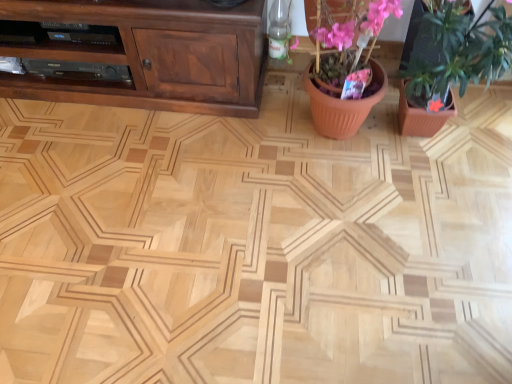
The width and height of the screenshot is (512, 384). What do you see at coordinates (151, 55) in the screenshot?
I see `brown wood cabinet at upper left` at bounding box center [151, 55].

The width and height of the screenshot is (512, 384). What do you see at coordinates (347, 69) in the screenshot? I see `terracotta pot at center` at bounding box center [347, 69].

This screenshot has width=512, height=384. What do you see at coordinates (451, 63) in the screenshot?
I see `pink matte flower pot at upper right` at bounding box center [451, 63].

Identify the location of pink matte flower pot at upper right. (451, 63).

Where is `brown wood cabinet at upper left`? brown wood cabinet at upper left is located at coordinates (151, 55).

From the picture: Is the depth of brown wood cabinet at upper left greater than that of pink matte flower pot at upper right?

Yes, brown wood cabinet at upper left is further from the camera.

Between brown wood cabinet at upper left and pink matte flower pot at upper right, which one appears on the left side from the viewer's perspective?

From the viewer's perspective, brown wood cabinet at upper left appears more on the left side.

Where is `houseplant that is above the brown wood cabinet at upper left (from a real-world perspective)`? The image size is (512, 384). houseplant that is above the brown wood cabinet at upper left (from a real-world perspective) is located at coordinates (451, 63).

From the picture: Are brown wood cabinet at upper left and pink matte flower pot at upper right located far from each other?

No, there isn't a large distance between brown wood cabinet at upper left and pink matte flower pot at upper right.

Image resolution: width=512 pixels, height=384 pixels. I want to click on houseplant that is above the terracotta pot at center (from a real-world perspective), so click(451, 63).

Can you confirm if terracotta pot at center is thinner than pink matte flower pot at upper right?

Correct, the width of terracotta pot at center is less than that of pink matte flower pot at upper right.

Based on the photo, which is more distant, [355,94] or [441,31]?

The point [355,94] is behind.

Is terracotta pot at center behind brown wood cabinet at upper left?

No, it is in front of brown wood cabinet at upper left.

Is brown wood cabinet at upper left surrounded by terracotta pot at center?

Definitely not — brown wood cabinet at upper left is not inside terracotta pot at center.

Considering the positions of objects terracotta pot at center and brown wood cabinet at upper left in the image provided, who is more to the left, terracotta pot at center or brown wood cabinet at upper left?

brown wood cabinet at upper left.

How far apart are terracotta pot at center and brown wood cabinet at upper left?

terracotta pot at center is 47.11 centimeters from brown wood cabinet at upper left.

Does pink matte flower pot at upper right lie behind brown wood cabinet at upper left?

No, the depth of pink matte flower pot at upper right is less than that of brown wood cabinet at upper left.

Can you tell me how much pink matte flower pot at upper right and brown wood cabinet at upper left differ in facing direction?

The facing directions of pink matte flower pot at upper right and brown wood cabinet at upper left are 6.99e-05 degrees apart.

From the image's perspective, which object appears higher, pink matte flower pot at upper right or brown wood cabinet at upper left?

brown wood cabinet at upper left is shown above in the image.

From the image's perspective, is brown wood cabinet at upper left above terracotta pot at center?

Yes, from the image's perspective, brown wood cabinet at upper left is over terracotta pot at center.

Which object is thinner, brown wood cabinet at upper left or terracotta pot at center?

Thinner between the two is terracotta pot at center.

Based on the photo, can you tell me how much brown wood cabinet at upper left and terracotta pot at center differ in facing direction?

The facing directions of brown wood cabinet at upper left and terracotta pot at center are 1.23e-05 degrees apart.

Is pink matte flower pot at upper right taller than terracotta pot at center?

Indeed, pink matte flower pot at upper right has a greater height compared to terracotta pot at center.

Is pink matte flower pot at upper right oriented towards terracotta pot at center?

No, pink matte flower pot at upper right does not turn towards terracotta pot at center.

Considering the sizes of objects pink matte flower pot at upper right and terracotta pot at center in the image provided, who is smaller, pink matte flower pot at upper right or terracotta pot at center?

With smaller size is terracotta pot at center.

I want to click on cabinetry above the pink matte flower pot at upper right (from the image's perspective), so click(x=151, y=55).

Locate an element on the screen. floral arrangement below the pink matte flower pot at upper right (from a real-world perspective) is located at coordinates (347, 69).

Considering their positions, is brown wood cabinet at upper left positioned further to pink matte flower pot at upper right than terracotta pot at center?

brown wood cabinet at upper left is further to pink matte flower pot at upper right.

Based on their spatial positions, is terracotta pot at center or brown wood cabinet at upper left further from pink matte flower pot at upper right?

brown wood cabinet at upper left lies further to pink matte flower pot at upper right than the other object.

Based on their spatial positions, is terracotta pot at center or pink matte flower pot at upper right closer to brown wood cabinet at upper left?

terracotta pot at center is closer to brown wood cabinet at upper left.

From the image, which object appears to be nearer to brown wood cabinet at upper left, pink matte flower pot at upper right or terracotta pot at center?

Among the two, terracotta pot at center is located nearer to brown wood cabinet at upper left.

Estimate the real-world distances between objects in this image. Which object is further from terracotta pot at center, brown wood cabinet at upper left or pink matte flower pot at upper right?

Based on the image, brown wood cabinet at upper left appears to be further to terracotta pot at center.

Looking at the image, which one is located further to terracotta pot at center, pink matte flower pot at upper right or brown wood cabinet at upper left?

Among the two, brown wood cabinet at upper left is located further to terracotta pot at center.

At what (x,y) coordinates should I click in order to perform the action: click on floral arrangement located between brown wood cabinet at upper left and pink matte flower pot at upper right in the left-right direction. Please return your answer as a coordinate pair (x, y). This screenshot has width=512, height=384. Looking at the image, I should click on (347, 69).